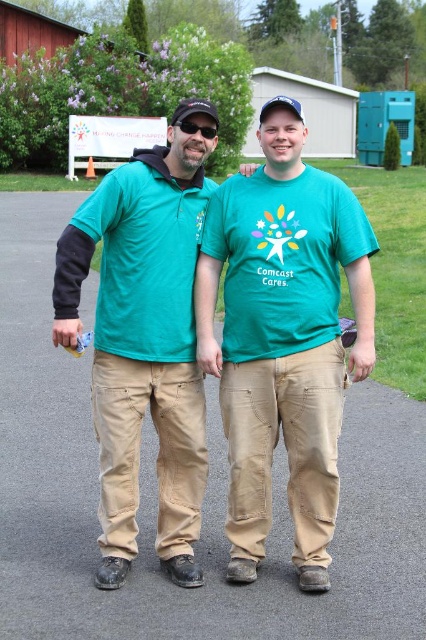
You are a photographer taking a picture of the two people in the scene. You notice the matte khaki pants at center and the black plastic sunglasses at center. Which object should you focus on first if you want to capture both in the same frame without moving the camera?

The matte khaki pants at center is below the black plastic sunglasses at center, so you should focus on the black plastic sunglasses at center first to ensure both are in the frame.

You are a photographer at the Comcast Cares event. You need to capture a photo where the matte green shirt at center and the black plastic sunglasses at center are both visible. Based on their positions, will the sunglasses be visible above or below the shirt in the final photo?

The matte green shirt at center is located below the black plastic sunglasses at center, so the sunglasses will be visible above the shirt in the final photo.

What is the 2D coordinate of the matte green shirt at center in the image?

The matte green shirt at center is located at the 2D coordinate point of (143, 344).